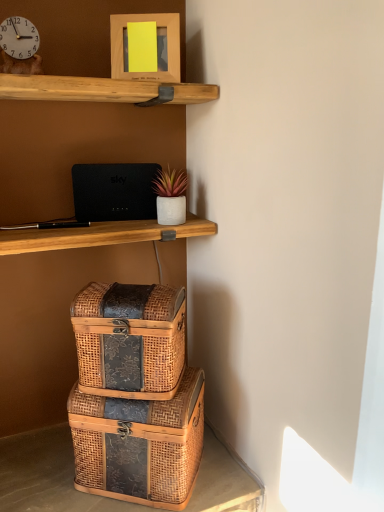
Question: From a real-world perspective, is woven wood trunk at lower center on top of woven wood box at lower center, which ranks as the 2th box in bottom-to-top order?

Choices:
 (A) no
 (B) yes

Answer: (A)

Question: From the image's perspective, is woven wood trunk at lower center above woven wood box at lower center, which ranks as the 2th box in bottom-to-top order?

Choices:
 (A) yes
 (B) no

Answer: (B)

Question: Does woven wood trunk at lower center appear on the right side of woven wood box at lower center, which ranks as the 2th box in bottom-to-top order?

Choices:
 (A) no
 (B) yes

Answer: (A)

Question: Is woven wood trunk at lower center not close to woven wood box at lower center, positioned as the 1th box in top-to-bottom order?

Choices:
 (A) yes
 (B) no

Answer: (B)

Question: Is woven wood trunk at lower center smaller than woven wood box at lower center, positioned as the 1th box in top-to-bottom order?

Choices:
 (A) no
 (B) yes

Answer: (B)

Question: Looking at the image, does white glossy clock at upper left seem bigger or smaller compared to black matte router at upper center?

Choices:
 (A) big
 (B) small

Answer: (B)

Question: From the image's perspective, is white glossy clock at upper left located above or below black matte router at upper center?

Choices:
 (A) above
 (B) below

Answer: (A)

Question: Is point click(x=33, y=47) closer or farther from the camera than point click(x=124, y=194)?

Choices:
 (A) closer
 (B) farther

Answer: (A)

Question: From a real-world perspective, is white glossy clock at upper left positioned above or below black matte router at upper center?

Choices:
 (A) below
 (B) above

Answer: (B)

Question: Is woven wood box at lower center, which ranks as the 2th box in bottom-to-top order, taller or shorter than black matte router at upper center?

Choices:
 (A) tall
 (B) short

Answer: (A)

Question: Relative to black matte router at upper center, is woven wood box at lower center, positioned as the 1th box in top-to-bottom order, in front or behind?

Choices:
 (A) front
 (B) behind

Answer: (A)

Question: Looking at their shapes, would you say woven wood box at lower center, which ranks as the 2th box in bottom-to-top order, is wider or thinner than black matte router at upper center?

Choices:
 (A) wide
 (B) thin

Answer: (A)

Question: Is point (91, 284) positioned closer to the camera than point (140, 217)?

Choices:
 (A) closer
 (B) farther

Answer: (A)

Question: Based on their sizes in the image, would you say woven wood box at center, the first box when ordered from bottom to top, is bigger or smaller than woven wood trunk at lower center?

Choices:
 (A) small
 (B) big

Answer: (B)

Question: Considering the positions of woven wood box at center, the first box when ordered from bottom to top, and woven wood trunk at lower center in the image, is woven wood box at center, the first box when ordered from bottom to top, wider or thinner than woven wood trunk at lower center?

Choices:
 (A) thin
 (B) wide

Answer: (A)